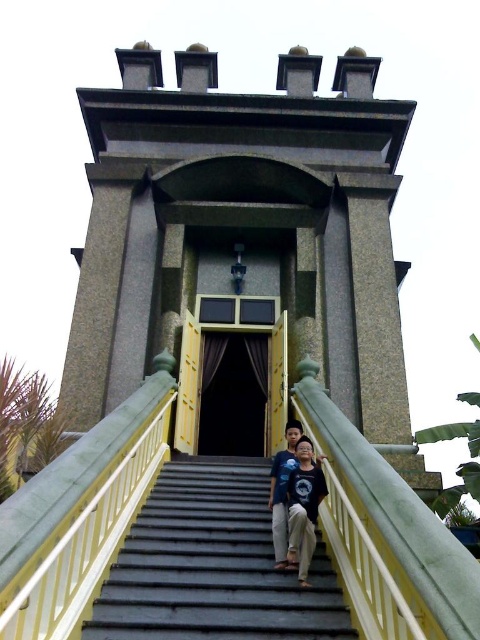
Question: Can you confirm if smooth concrete stairs at center is positioned below blue denim shirt at center?

Choices:
 (A) yes
 (B) no

Answer: (A)

Question: Among these objects, which one is farthest from the camera?

Choices:
 (A) blue denim shirt at center
 (B) smooth concrete stairs at center

Answer: (A)

Question: Can you confirm if smooth concrete stairs at center is smaller than blue denim shirt at center?

Choices:
 (A) yes
 (B) no

Answer: (B)

Question: Is smooth concrete stairs at center thinner than blue denim shirt at center?

Choices:
 (A) yes
 (B) no

Answer: (B)

Question: Which object appears farthest from the camera in this image?

Choices:
 (A) smooth concrete stairs at center
 (B) blue denim shirt at center

Answer: (B)